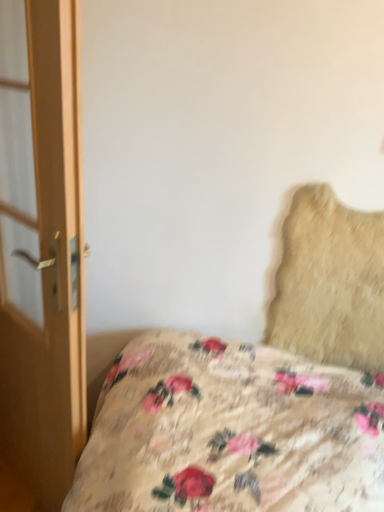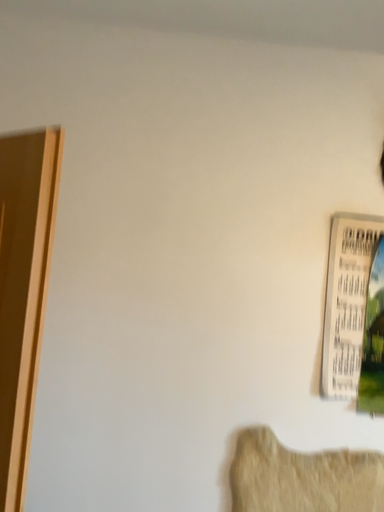
Question: Which way did the camera rotate in the video?

Choices:
 (A) rotated right
 (B) rotated left

Answer: (A)